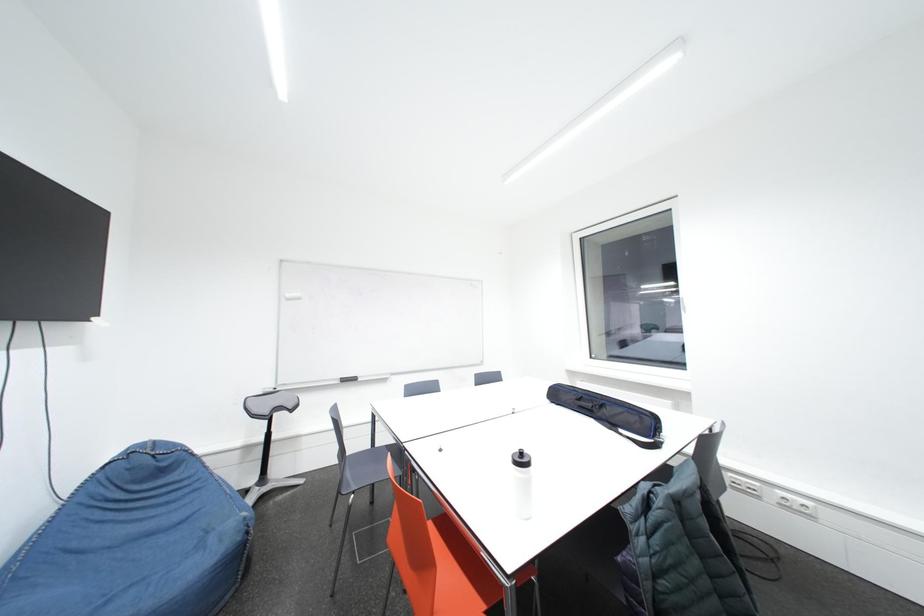
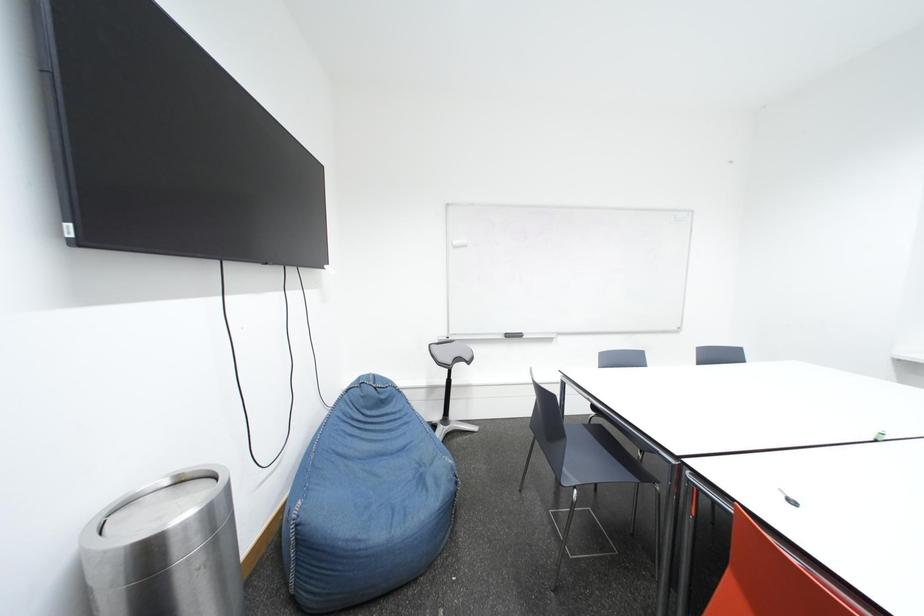
Question: The images are taken continuously from a first-person perspective. In which direction is your viewpoint rotating?

Choices:
 (A) Left
 (B) Right
 (C) Up
 (D) Down

Answer: (A)